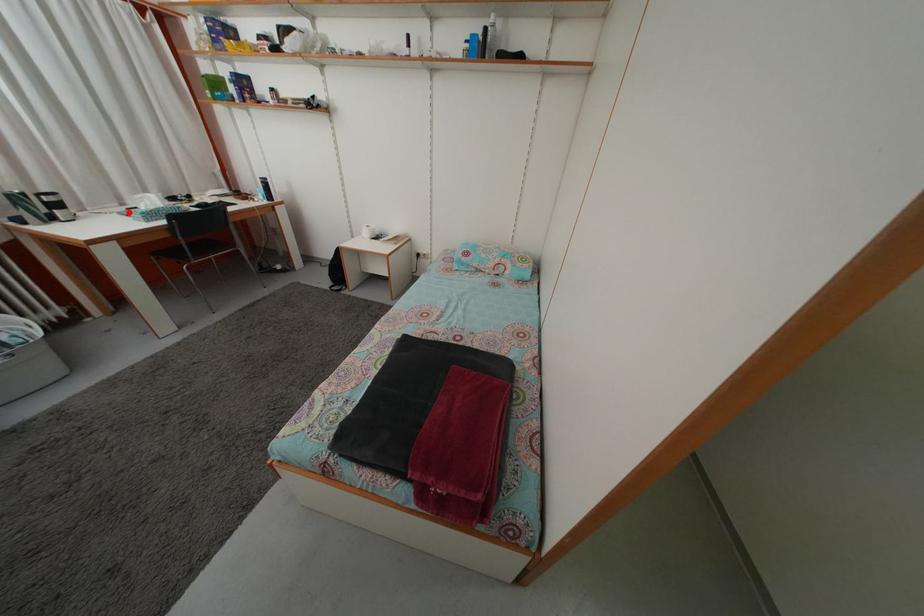
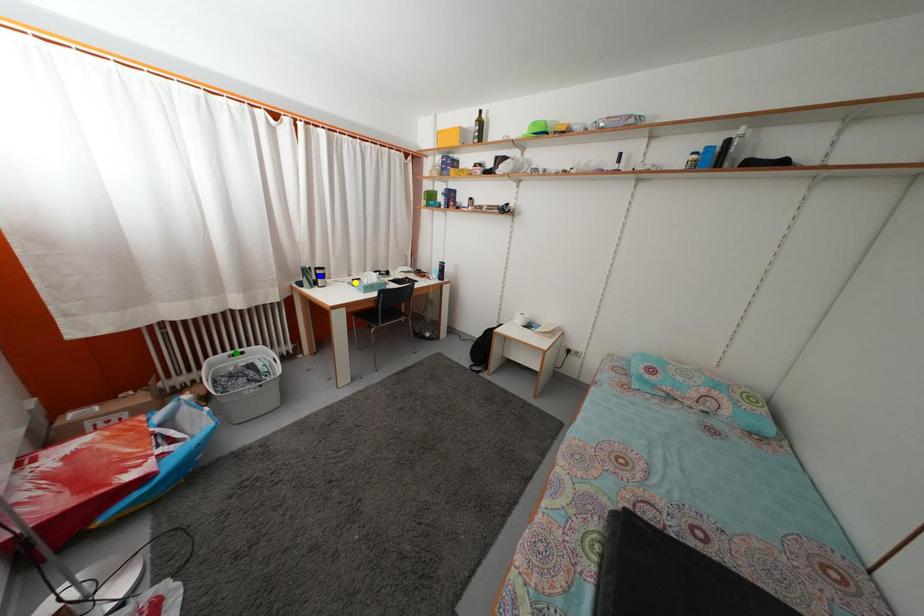
Question: I am providing you with two images of the same scene from different viewpoints. A red point is marked on the first image. You are given multiple points on the second image. Which mark in image 2 goes with the point in image 1?

Choices:
 (A) yellow point
 (B) green point
 (C) blue point

Answer: (A)